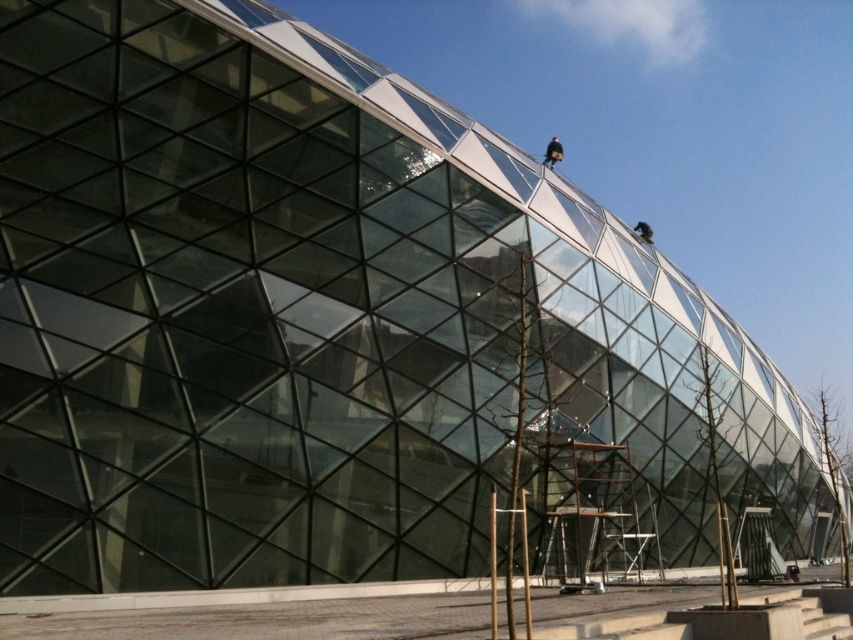
In the scene shown: You are an architect reviewing the construction site of the modern building. You notice the black fabric construction worker at upper center and the dark brown leather helmet at upper right. Which object is positioned to the right side?

The dark brown leather helmet at upper right is positioned to the right of the black fabric construction worker at upper center.

You are a visitor standing in front of the modern building and notice two items at the top of the structure. The first is a black fabric construction worker at upper center and the second is a dark brown leather helmet at upper right. Which of these two items appears wider from your vantage point?

The dark brown leather helmet at upper right appears wider because the black fabric construction worker at upper center has a lesser width compared to it.

You are standing at the base of the building and want to know the distance between the black fabric construction worker at upper center and the dark brown leather helmet at upper right. Can you estimate it?

The black fabric construction worker at upper center is 9.52 meters away from the dark brown leather helmet at upper right.